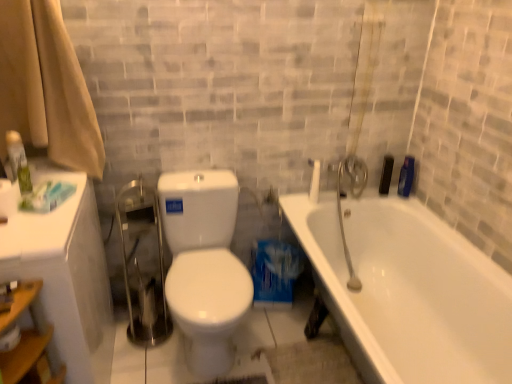
The width and height of the screenshot is (512, 384). Find the location of `free location to the left of blue glossy bottle at upper right, arranged as the second toiletry when viewed from the front`. free location to the left of blue glossy bottle at upper right, arranged as the second toiletry when viewed from the front is located at coordinates (378, 195).